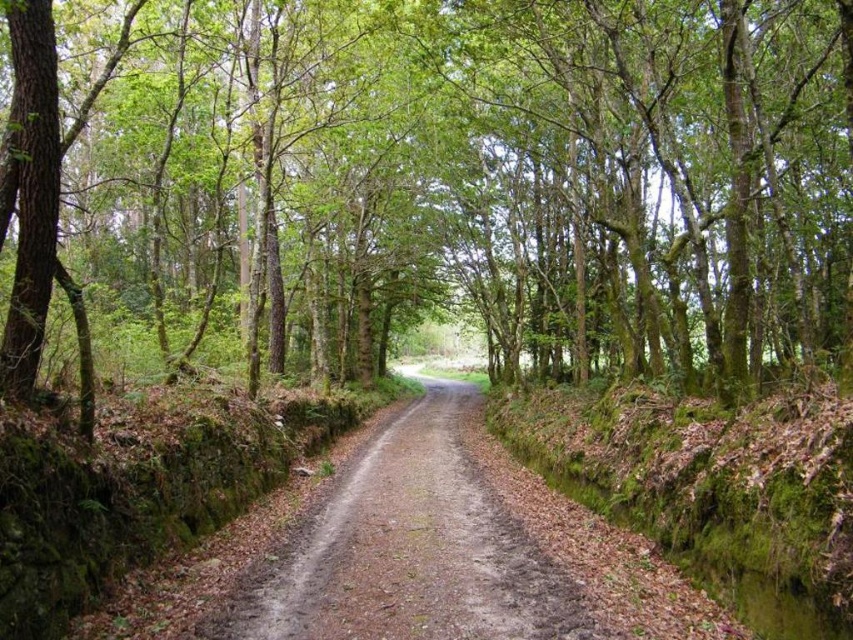
Question: Which object is farther from the camera taking this photo?

Choices:
 (A) dirt/gravel road at center
 (B) green leafy tree at center

Answer: (A)

Question: Is green leafy tree at center smaller than dirt/gravel road at center?

Choices:
 (A) yes
 (B) no

Answer: (B)

Question: Does green leafy tree at center come in front of dirt/gravel road at center?

Choices:
 (A) no
 (B) yes

Answer: (B)

Question: Among these points, which one is nearest to the camera?

Choices:
 (A) (466, 122)
 (B) (312, 625)

Answer: (B)

Question: Where is green leafy tree at center located in relation to dirt/gravel road at center in the image?

Choices:
 (A) left
 (B) right

Answer: (A)